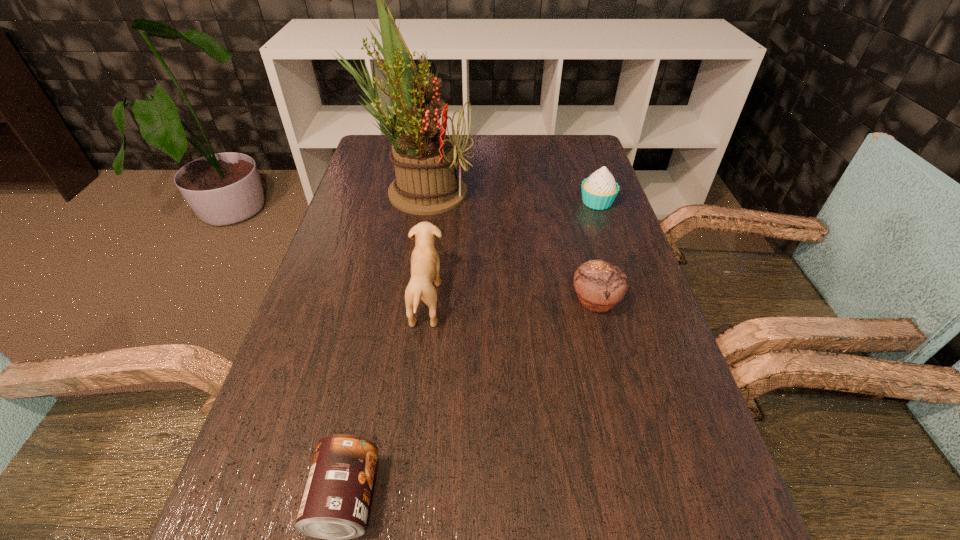
This screenshot has height=540, width=960. What are the coordinates of `the tallest object` in the screenshot? It's located at (425, 160).

The width and height of the screenshot is (960, 540). I want to click on puppy, so click(425, 265).

I want to click on cupcake, so click(599, 191).

At what (x,y) coordinates should I click in order to perform the action: click on muffin. Please return your answer as a coordinate pair (x, y). The width and height of the screenshot is (960, 540). Looking at the image, I should click on (599, 285).

Find the location of `free region located in front of the flower arrangement with the fan visible`. free region located in front of the flower arrangement with the fan visible is located at coordinates (586, 191).

This screenshot has width=960, height=540. Identify the location of vacant space positioned 0.170m on the left side of the second tallest object. (519, 301).

Locate an element on the screen. Image resolution: width=960 pixels, height=540 pixels. free spot located on the back of the cupcake is located at coordinates (575, 137).

Find the location of a particular element. The width and height of the screenshot is (960, 540). vacant area situated on the front of the muffin is located at coordinates (637, 467).

Where is `object positioned at the far edge`? Image resolution: width=960 pixels, height=540 pixels. object positioned at the far edge is located at coordinates (425, 160).

This screenshot has width=960, height=540. Find the location of `object positioned at the left edge`. object positioned at the left edge is located at coordinates (425, 160).